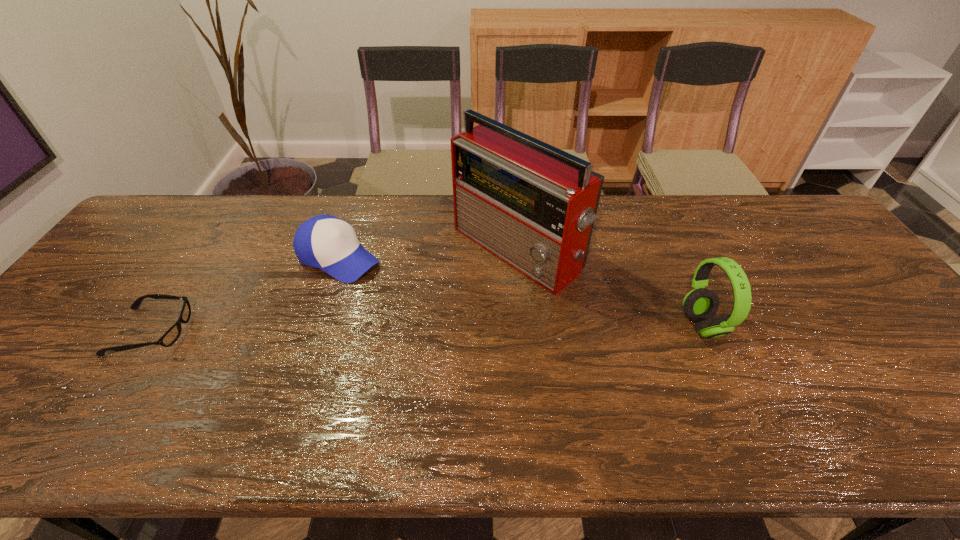
The height and width of the screenshot is (540, 960). What are the coordinates of `vacant spot on the desktop that is between the leftmost object and the second tallest object and is positioned on the front-facing side of the radio receiver` in the screenshot? It's located at (403, 329).

Find the location of a particular element. vacant space on the desktop that is between the spectacles and the rightmost object and is positioned on the front-facing side of the second object from left to right is located at coordinates (454, 328).